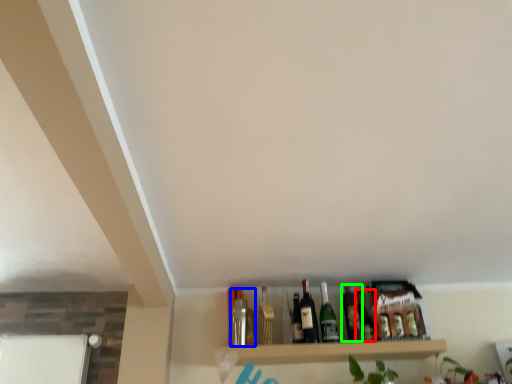
Question: Estimate the real-world distances between objects in this image. Which object is farther from bottle (highlighted by a red box), bottle (highlighted by a blue box) or beer bottle (highlighted by a green box)?

Choices:
 (A) bottle
 (B) beer bottle

Answer: (A)